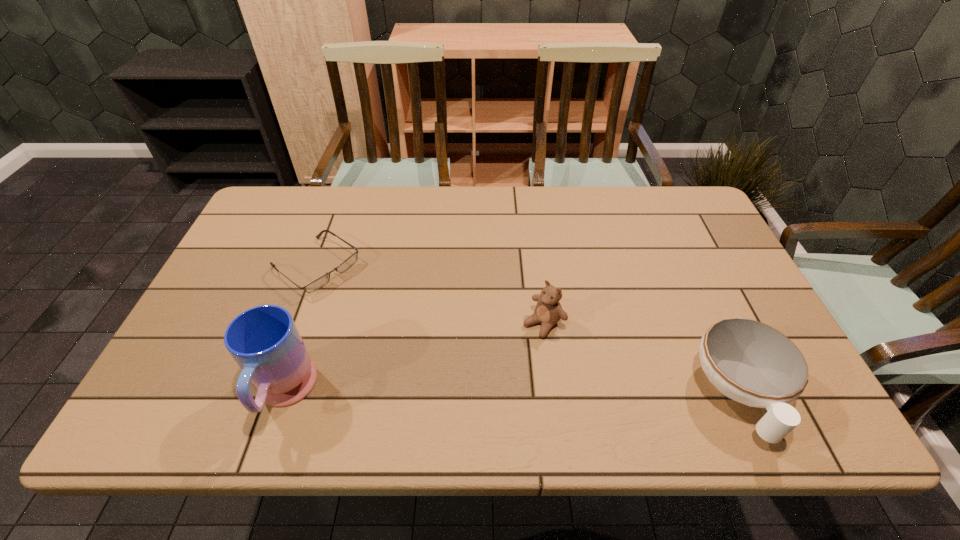
Where is `vacant space on the desktop that is between the mug and the chinaware and is positioned on the front-facing side of the shortest object`? vacant space on the desktop that is between the mug and the chinaware and is positioned on the front-facing side of the shortest object is located at coordinates (492, 394).

Locate an element on the screen. Image resolution: width=960 pixels, height=540 pixels. vacant spot on the desktop that is between the mug and the chinaware and is positioned on the front-facing side of the third object from left to right is located at coordinates (467, 394).